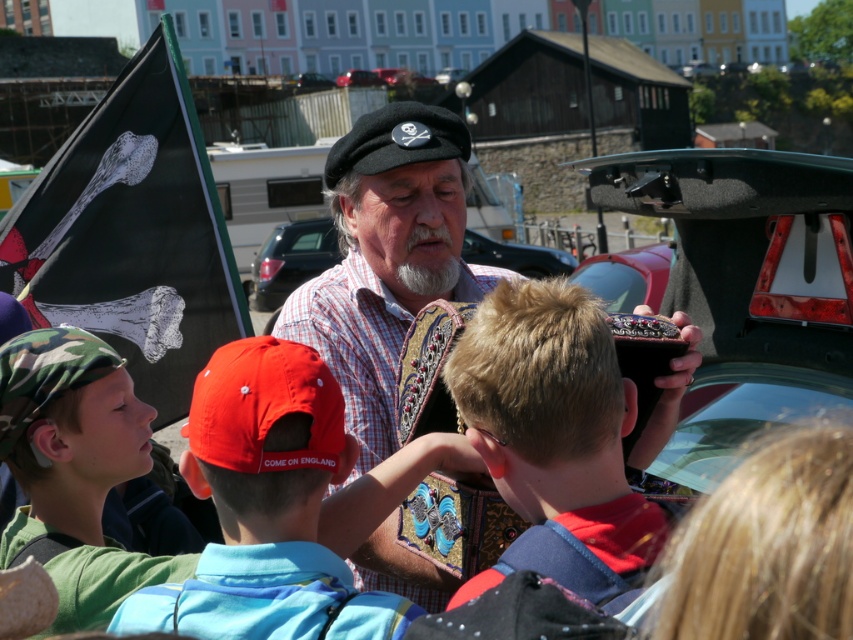
Question: Which object appears closest to the camera in this image?

Choices:
 (A) black fabric flag at left
 (B) plaid shirt at center
 (C) metallic car trunk at center
 (D) blonde hair boy at center

Answer: (D)

Question: Does blonde hair boy at center appear under red fabric cap at center?

Choices:
 (A) no
 (B) yes

Answer: (A)

Question: Where is black fabric flag at left located in relation to metallic car trunk at center in the image?

Choices:
 (A) right
 (B) left

Answer: (B)

Question: Based on their relative distances, which object is nearer to the blonde hair boy at center?

Choices:
 (A) black fabric flag at left
 (B) metallic car trunk at center
 (C) red fabric cap at center

Answer: (C)

Question: Is plaid shirt at center to the left of red fabric cap at center from the viewer's perspective?

Choices:
 (A) yes
 (B) no

Answer: (B)

Question: Considering the real-world distances, which object is farthest from the plaid shirt at center?

Choices:
 (A) red fabric cap at center
 (B) blonde hair boy at center
 (C) black fabric flag at left

Answer: (C)